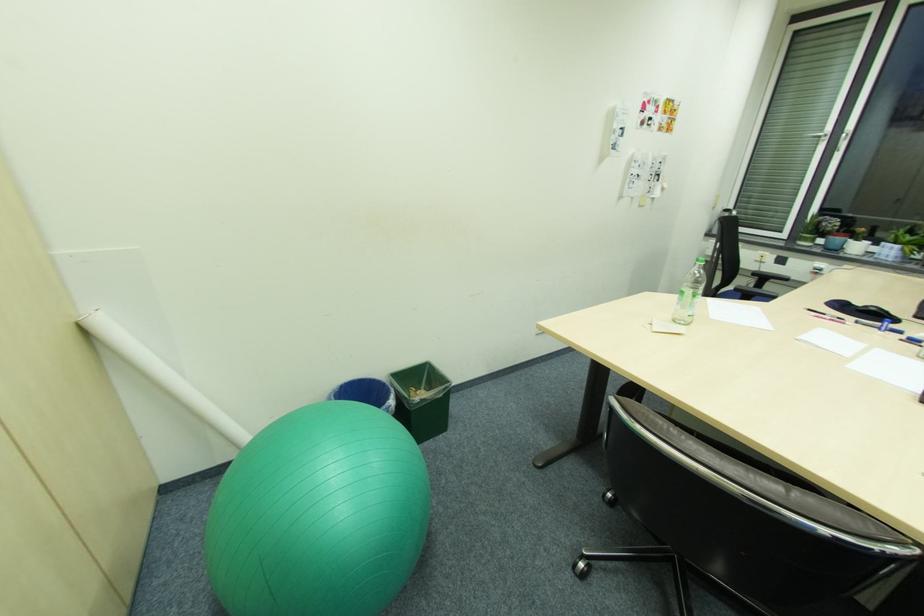
Find where to sit the green exercise ball. Please return your answer as a coordinate pair (x, y).

(319, 515)